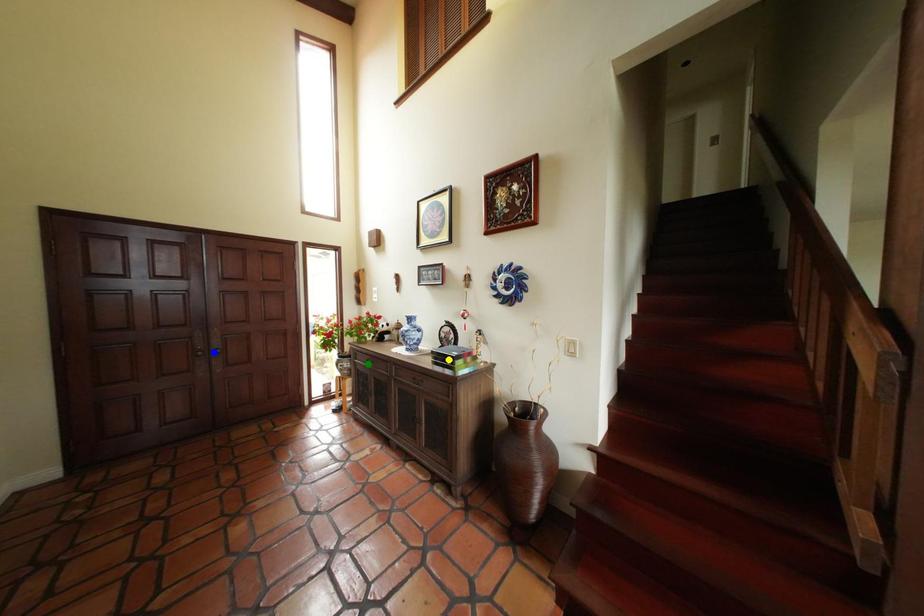
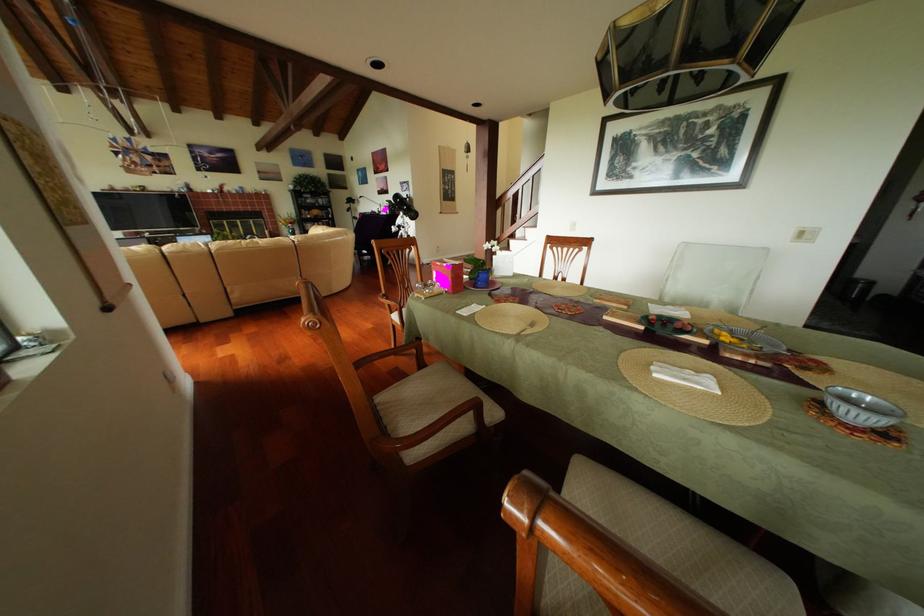
I am providing you with two images of the same scene from different viewpoints. Three points are marked in image1. Which point corresponds to a part or object that is occluded in image2?In image1, three points are marked. Which of them correspond to a part or object that is occluded in image2?Among the three points shown in image1, which one corresponds to a part or object that is no longer visible due to occlusion in image2?

blue point, yellow point, green point